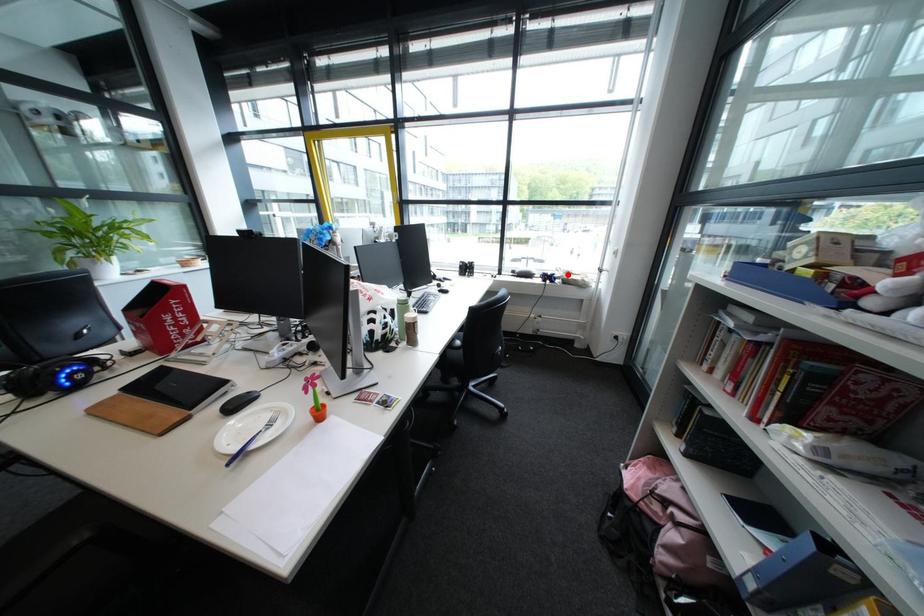
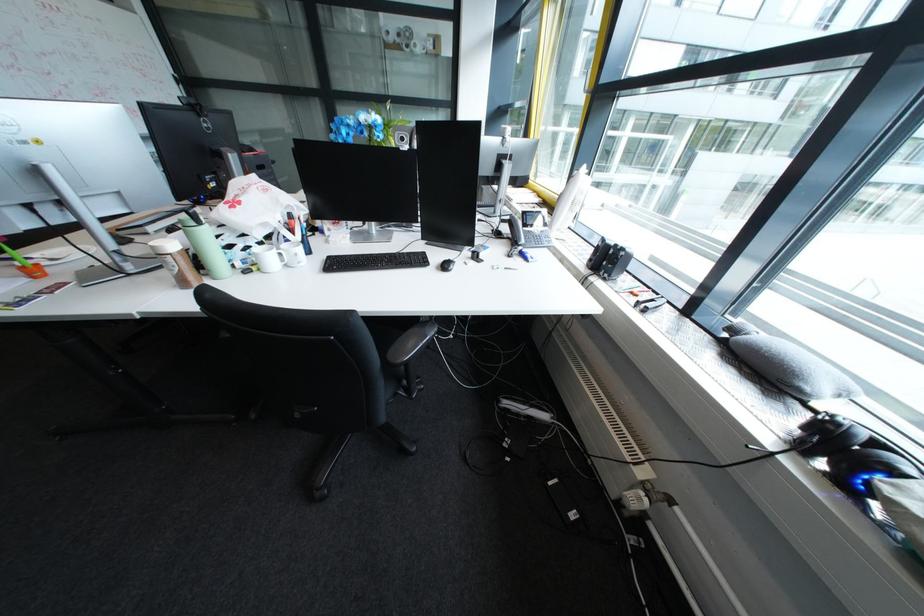
The point at the highlighted location is marked in the first image. Where is the corresponding point in the second image?

(909, 474)